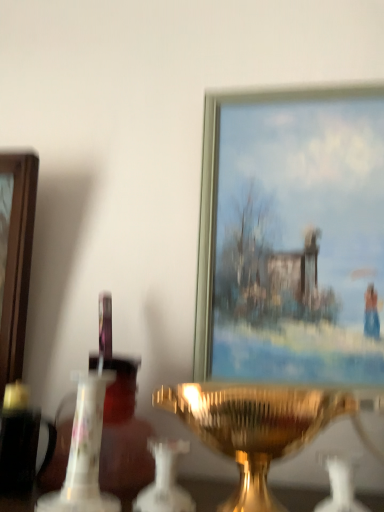
Question: From the image's perspective, is white glass candle holder at center, the first candle holder when ordered from right to left, below metallic gold picture frame at upper center?

Choices:
 (A) yes
 (B) no

Answer: (A)

Question: Is white glass candle holder at center, the third candle holder in the left-to-right sequence, facing away from metallic gold picture frame at upper center?

Choices:
 (A) yes
 (B) no

Answer: (B)

Question: Does white glass candle holder at center, the first candle holder when ordered from right to left, have a greater width compared to metallic gold picture frame at upper center?

Choices:
 (A) no
 (B) yes

Answer: (B)

Question: Does white glass candle holder at center, the first candle holder when ordered from right to left, appear on the right side of metallic gold picture frame at upper center?

Choices:
 (A) yes
 (B) no

Answer: (B)

Question: Are white glass candle holder at center, the third candle holder in the left-to-right sequence, and metallic gold picture frame at upper center beside each other?

Choices:
 (A) no
 (B) yes

Answer: (A)

Question: Would you consider white glass candle holder at center, the third candle holder in the left-to-right sequence, to be distant from metallic gold picture frame at upper center?

Choices:
 (A) yes
 (B) no

Answer: (B)

Question: Is gold metallic candle holder at center, the second candle holder in the left-to-right sequence, turned away from white glass candle holder at center, the first candle holder when ordered from right to left?

Choices:
 (A) no
 (B) yes

Answer: (A)

Question: Would you say white glass candle holder at center, the first candle holder when ordered from right to left, is part of gold metallic candle holder at center, the 2th candle holder when ordered from right to left,'s contents?

Choices:
 (A) yes
 (B) no

Answer: (A)

Question: Can you confirm if gold metallic candle holder at center, the second candle holder in the left-to-right sequence, is wider than white glass candle holder at center, the first candle holder when ordered from right to left?

Choices:
 (A) yes
 (B) no

Answer: (A)

Question: From a real-world perspective, does gold metallic candle holder at center, the 2th candle holder when ordered from right to left, sit lower than white glass candle holder at center, the first candle holder when ordered from right to left?

Choices:
 (A) yes
 (B) no

Answer: (B)

Question: Is gold metallic candle holder at center, the second candle holder in the left-to-right sequence, outside of white glass candle holder at center, the first candle holder when ordered from right to left?

Choices:
 (A) no
 (B) yes

Answer: (B)

Question: Is gold metallic candle holder at center, the second candle holder in the left-to-right sequence, closer to the viewer compared to white glass candle holder at center, the third candle holder in the left-to-right sequence?

Choices:
 (A) no
 (B) yes

Answer: (B)

Question: Is white porcelain candle holder at center, which is the third candle holder in right-to-left order, not within white glass candle holder at center, the first candle holder when ordered from right to left?

Choices:
 (A) no
 (B) yes

Answer: (B)